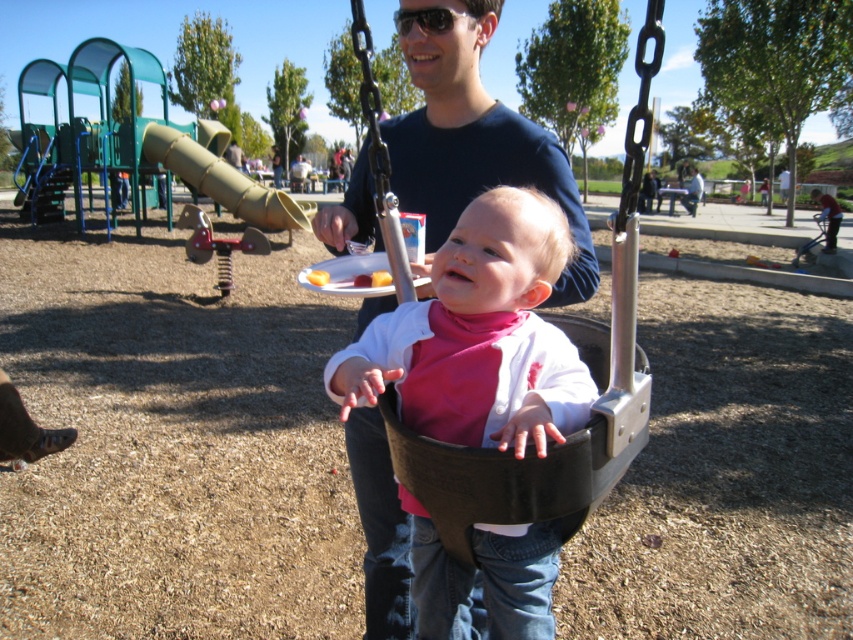
Measure the distance between point (x=409, y=314) and camera.

Point (x=409, y=314) is 1.67 meters away from camera.

Is pink matte bib at center positioned before black plastic swing at center?

No.

Is point (480, 294) positioned after point (503, 474)?

Yes.

Image resolution: width=853 pixels, height=640 pixels. In order to click on pink matte bib at center in this screenshot , I will do `click(479, 336)`.